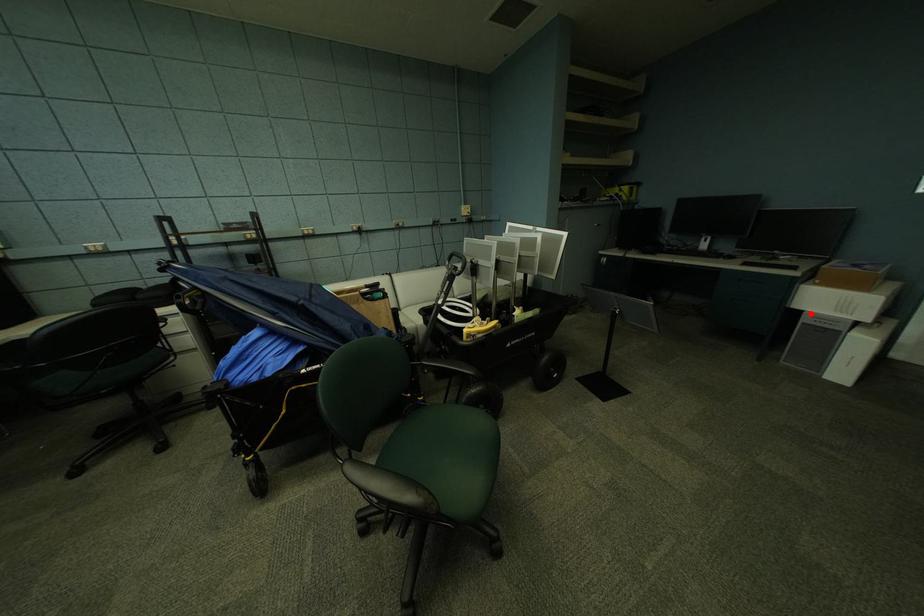
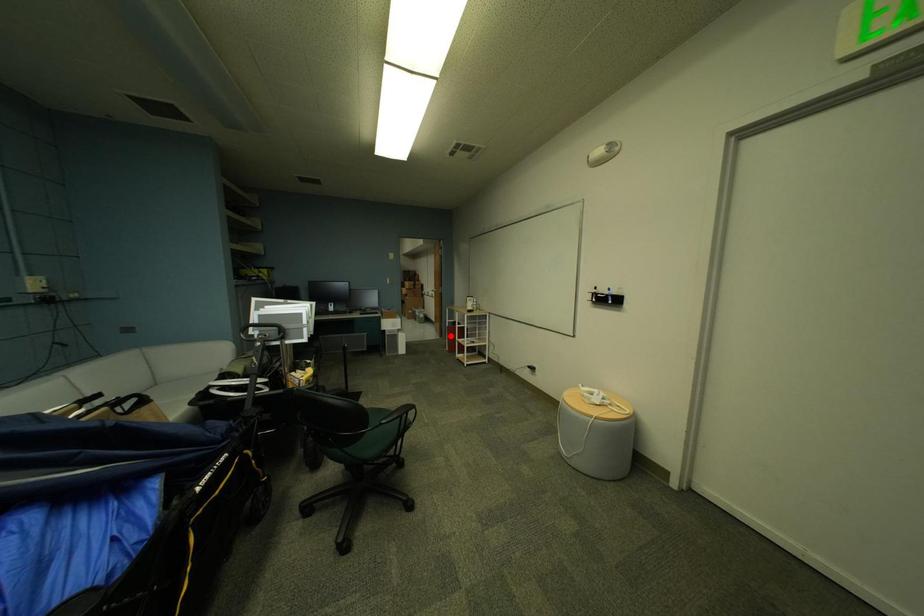
I am providing you with two images of the same scene from different viewpoints. A red point is marked on the first image and another point is marked on the second image. Does the point marked in image1 correspond to the same location as the one in image2?

No